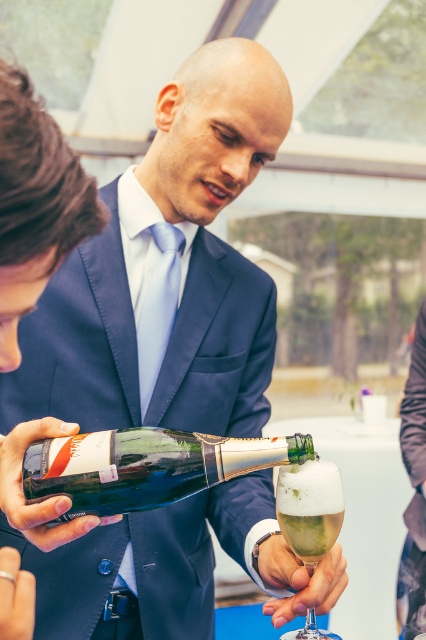
Is point (143, 490) in front of point (293, 545)?

Yes, point (143, 490) is in front of point (293, 545).

Which of these two, shiny metallic champagne bottle at center or clear glass wine at center, stands taller?

shiny metallic champagne bottle at center is taller.

Who is more forward, (127,493) or (325,532)?

Point (127,493) is more forward.

I want to click on shiny metallic champagne bottle at center, so click(x=146, y=467).

Can you confirm if clear glass wine glass at center is positioned to the left of clear glass wine at center?

In fact, clear glass wine glass at center is to the right of clear glass wine at center.

Between point (339, 499) and point (298, 538), which one is positioned in front?

Positioned in front is point (298, 538).

At what (x,y) coordinates should I click in order to perform the action: click on clear glass wine glass at center. Please return your answer as a coordinate pair (x, y). Looking at the image, I should click on (310, 508).

Identify the location of clear glass wine glass at center. (310, 508).

Between point (135, 497) and point (330, 531), which one is positioned behind?

Point (330, 531)

Which of these two, shiny metallic champagne bottle at center or clear glass wine glass at center, stands taller?

With more height is clear glass wine glass at center.

Who is more forward, (42, 449) or (276, 481)?

Point (42, 449) is more forward.

This screenshot has width=426, height=640. Identify the location of shiny metallic champagne bottle at center. (146, 467).